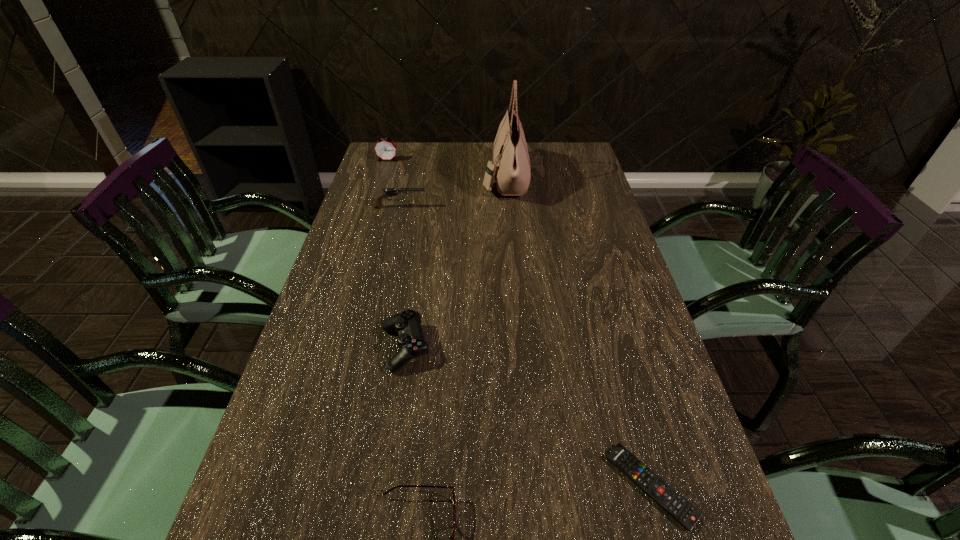
Image resolution: width=960 pixels, height=540 pixels. I want to click on free space located 0.390m on the clock face of the alarm clock, so click(x=368, y=224).

Identify the location of free region located 0.200m aiming along the barrel of the gun. pyautogui.click(x=488, y=207).

Identify the location of vacant space positioned 0.260m on the back of the third nearest object. (419, 255).

Where is `vacant area situated 0.060m on the left of the remote control`? vacant area situated 0.060m on the left of the remote control is located at coordinates (578, 486).

You are a GUI agent. You are given a task and a screenshot of the screen. Output one action in this format:
    pyautogui.click(x=<x>, y=<y>)
    Task: Click on the handbag that is at the far edge
    
    Given the screenshot: What is the action you would take?
    pyautogui.click(x=511, y=169)

I want to click on alarm clock present at the far edge, so click(385, 149).

What are the coordinates of `alarm clock at the left edge` in the screenshot? It's located at (385, 149).

Where is `gun that is at the left edge`? gun that is at the left edge is located at coordinates (388, 192).

You are a GUI agent. You are given a task and a screenshot of the screen. Output one action in this format:
    pyautogui.click(x=<x>, y=<y>)
    Task: Click on the object positioned at the right edge
    
    Given the screenshot: What is the action you would take?
    click(687, 515)

The height and width of the screenshot is (540, 960). Find the location of `object at the far left corner`. object at the far left corner is located at coordinates (385, 149).